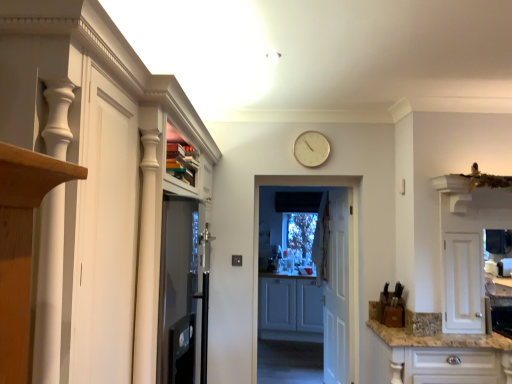
Question: Is white glossy cabinet at left, which is the 3th cabinetry in back-to-front order, smaller than white wooden door at center, the 1th door when ordered from back to front?

Choices:
 (A) no
 (B) yes

Answer: (A)

Question: Is white glossy cabinet at left, arranged as the third cabinetry when viewed from the right, aimed at white wooden door at center, which is the second door from left to right?

Choices:
 (A) no
 (B) yes

Answer: (A)

Question: From a real-world perspective, is white glossy cabinet at left, the 1th cabinetry in the front-to-back sequence, under white wooden door at center, which is counted as the second door, starting from the front?

Choices:
 (A) yes
 (B) no

Answer: (B)

Question: From the image's perspective, is white glossy cabinet at left, the 1th cabinetry in the front-to-back sequence, located beneath white wooden door at center, which is counted as the second door, starting from the front?

Choices:
 (A) no
 (B) yes

Answer: (A)

Question: Can you confirm if white glossy cabinet at left, which is the 3th cabinetry in back-to-front order, is positioned to the right of white wooden door at center, which appears as the first door when viewed from the right?

Choices:
 (A) yes
 (B) no

Answer: (B)

Question: Based on their positions, is white glossy cabinet at lower right, acting as the second cabinetry starting from the back, located to the left or right of white wooden door at center, which is counted as the second door, starting from the front?

Choices:
 (A) left
 (B) right

Answer: (B)

Question: Is white glossy cabinet at lower right, acting as the second cabinetry starting from the back, inside the boundaries of white wooden door at center, which is counted as the second door, starting from the front, or outside?

Choices:
 (A) outside
 (B) inside

Answer: (A)

Question: Considering the positions of white glossy cabinet at lower right, the third cabinetry positioned from the left, and white wooden door at center, the 1th door when ordered from back to front, in the image, is white glossy cabinet at lower right, the third cabinetry positioned from the left, bigger or smaller than white wooden door at center, the 1th door when ordered from back to front,?

Choices:
 (A) big
 (B) small

Answer: (A)

Question: Does point (482, 354) appear closer or farther from the camera than point (332, 314)?

Choices:
 (A) closer
 (B) farther

Answer: (A)

Question: From their relative heights in the image, would you say white glossy cabinet at lower right, acting as the second cabinetry starting from the back, is taller or shorter than white plastic clock at upper center?

Choices:
 (A) short
 (B) tall

Answer: (B)

Question: Would you say white glossy cabinet at lower right, positioned as the second cabinetry in front-to-back order, is to the left or to the right of white plastic clock at upper center in the picture?

Choices:
 (A) right
 (B) left

Answer: (A)

Question: In the image, is white glossy cabinet at lower right, which is the 1th cabinetry from right to left, positioned in front of or behind white plastic clock at upper center?

Choices:
 (A) behind
 (B) front

Answer: (B)

Question: Considering the positions of point (430, 372) and point (315, 130), is point (430, 372) closer or farther from the camera than point (315, 130)?

Choices:
 (A) closer
 (B) farther

Answer: (A)

Question: From their relative heights in the image, would you say white plastic clock at upper center is taller or shorter than white glossy cabinet at left, the 1th cabinetry in the front-to-back sequence?

Choices:
 (A) short
 (B) tall

Answer: (A)

Question: Would you say white plastic clock at upper center is inside or outside white glossy cabinet at left, arranged as the third cabinetry when viewed from the right?

Choices:
 (A) inside
 (B) outside

Answer: (B)